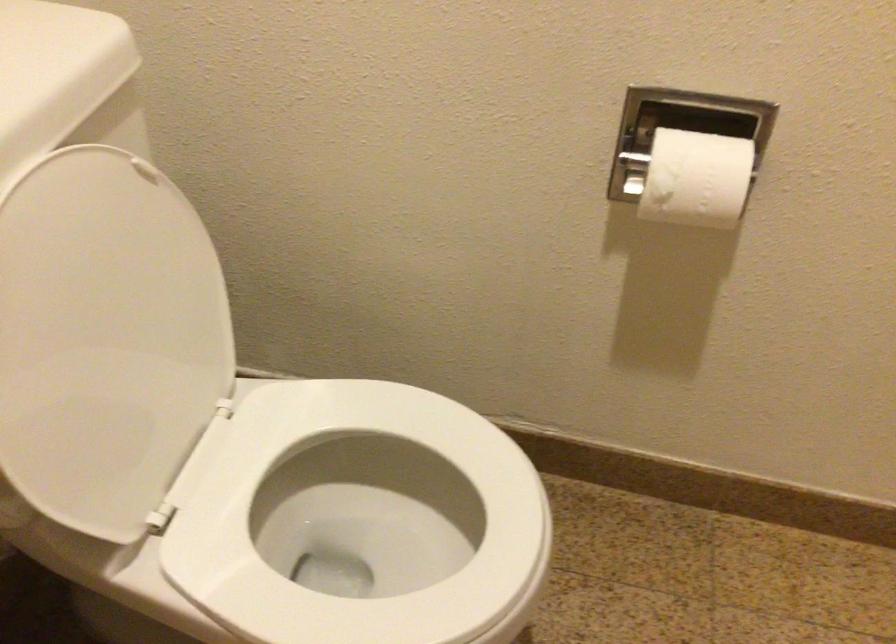
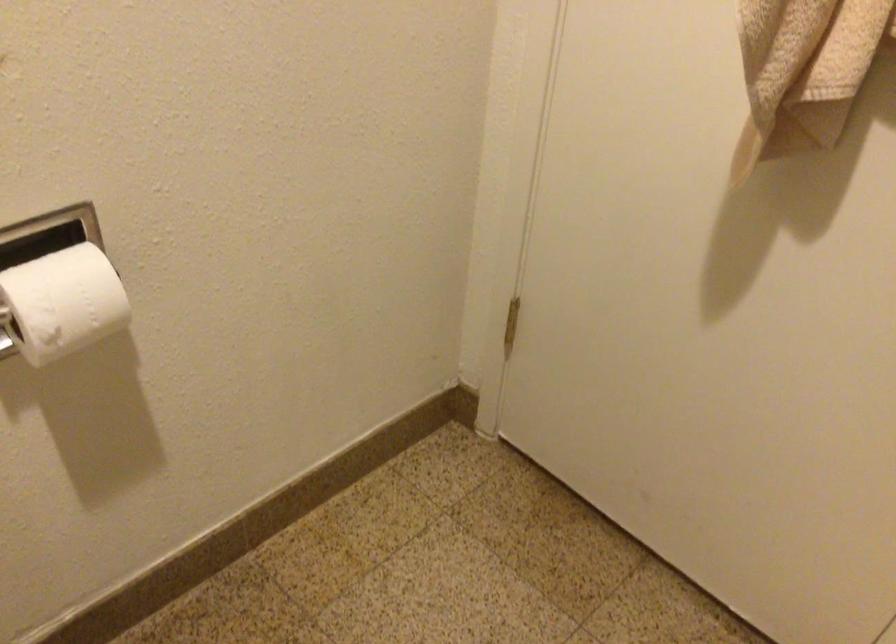
The point at (676,169) is marked in the first image. Where is the corresponding point in the second image?

(62, 303)